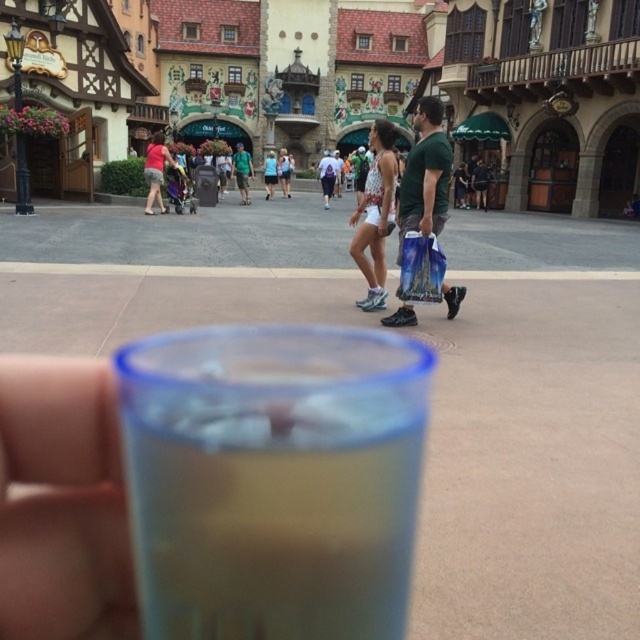
Who is positioned more to the left, translucent plastic cup at center or green cotton t-shirt at center?

From the viewer's perspective, translucent plastic cup at center appears more on the left side.

Which is below, translucent plastic cup at center or green cotton t-shirt at center?

translucent plastic cup at center is lower down.

Find the location of a particular element. This screenshot has height=640, width=640. translucent plastic cup at center is located at coordinates (273, 480).

Does translucent plastic cup at center have a greater width compared to matte red shirt at center?

In fact, translucent plastic cup at center might be narrower than matte red shirt at center.

Can you confirm if translucent plastic cup at center is taller than matte red shirt at center?

Incorrect, translucent plastic cup at center's height is not larger of matte red shirt at center's.

Does point (193, 460) come in front of point (161, 140)?

That is True.

You are a GUI agent. You are given a task and a screenshot of the screen. Output one action in this format:
    pyautogui.click(x=<x>, y=<y>)
    Task: Click on the translucent plastic cup at center
    
    Given the screenshot: What is the action you would take?
    pyautogui.click(x=273, y=480)

Is point (428, 163) more distant than point (161, 211)?

No, (428, 163) is closer to viewer.

Does green cotton t-shirt at center appear under matte red shirt at center?

Incorrect, green cotton t-shirt at center is not positioned below matte red shirt at center.

Which is behind, point (412, 152) or point (163, 132)?

The point (163, 132) is more distant.

Identify the location of green cotton t-shirt at center. (426, 173).